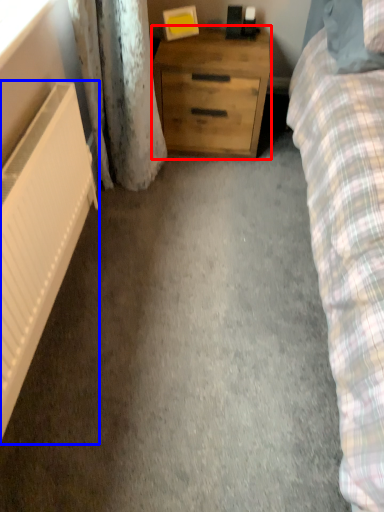
Question: Which point is further to the camera, chest of drawers (highlighted by a red box) or radiator (highlighted by a blue box)?

Choices:
 (A) chest of drawers
 (B) radiator

Answer: (A)